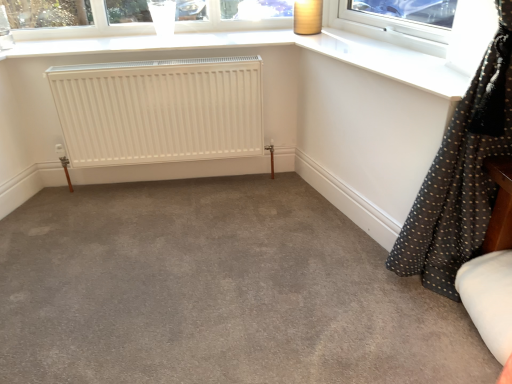
Question: From the image's perspective, relative to white matte radiator at center, is clear glass window at upper center above or below?

Choices:
 (A) below
 (B) above

Answer: (B)

Question: From a real-world perspective, is clear glass window at upper center positioned above or below white matte radiator at center?

Choices:
 (A) above
 (B) below

Answer: (A)

Question: Which is farther from the gray carpet at center?

Choices:
 (A) white matte radiator at center
 (B) black dotted fabric at right
 (C) matte brown lampshade at upper right
 (D) clear glass window at upper center

Answer: (D)

Question: Which of these objects is positioned farthest from the gray carpet at center?

Choices:
 (A) white matte radiator at center
 (B) clear glass window at upper center
 (C) matte brown lampshade at upper right
 (D) black dotted fabric at right

Answer: (B)